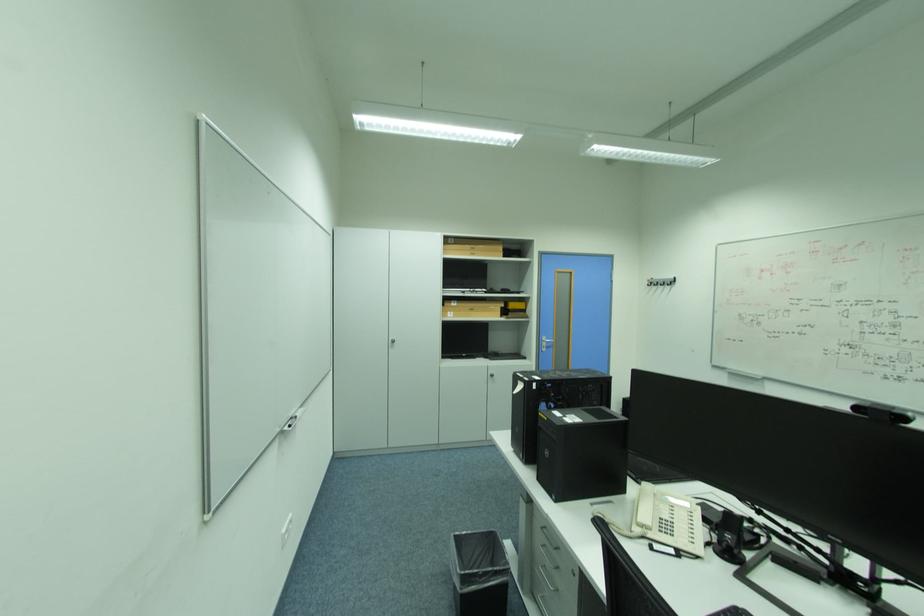
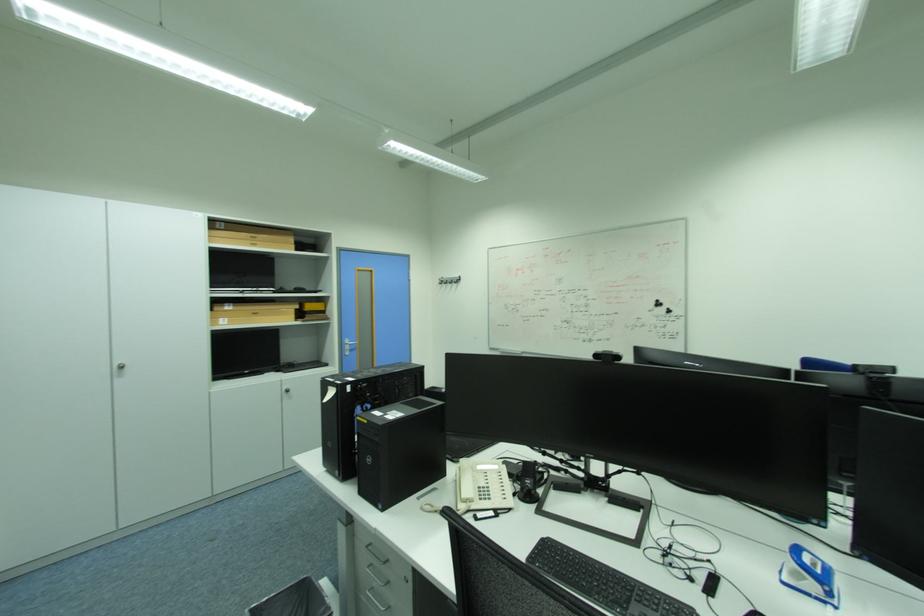
The point at (661, 288) is marked in the first image. Where is the corresponding point in the second image?

(451, 286)